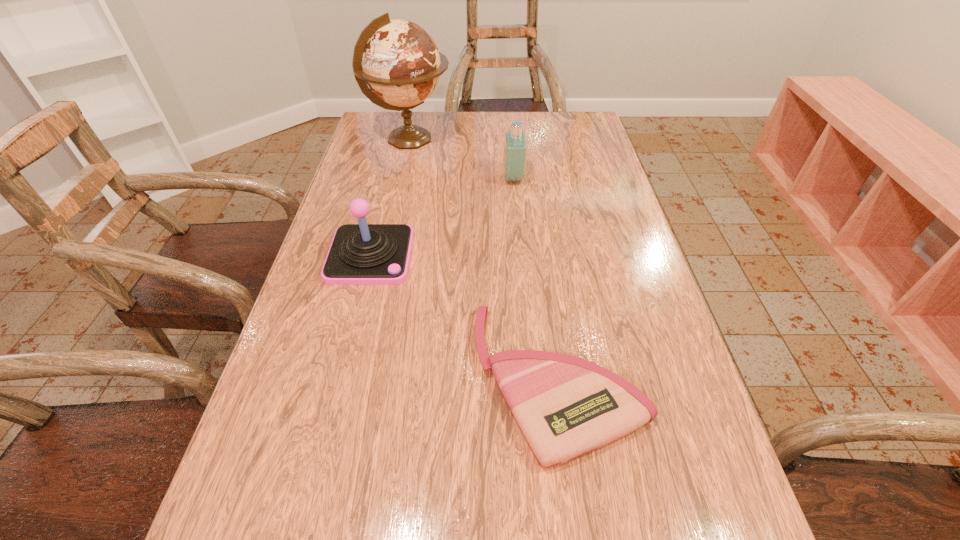
Where is `vacant area at the far right corner`? The width and height of the screenshot is (960, 540). vacant area at the far right corner is located at coordinates (594, 145).

You are a GUI agent. You are given a task and a screenshot of the screen. Output one action in this format:
    pyautogui.click(x=<x>, y=<y>)
    Task: Click on the vacant area that lies between the third nearest object and the joystick
    This screenshot has width=960, height=540.
    Given the screenshot: What is the action you would take?
    pyautogui.click(x=442, y=217)

Where is `vacant region between the perfume and the nearest object`? Image resolution: width=960 pixels, height=540 pixels. vacant region between the perfume and the nearest object is located at coordinates (536, 279).

Where is `free space between the tallest object and the joystick`? free space between the tallest object and the joystick is located at coordinates (391, 198).

What are the coordinates of `free space that is in between the second farthest object and the shortest object` in the screenshot? It's located at (536, 279).

Locate which object ranks third in proximity to the third farthest object. Please provide its 2D coordinates. Your answer should be formatted as a tuple, i.e. [(x, y)], where the tuple contains the x and y coordinates of a point satisfying the conditions above.

[(399, 61)]

Identify which object is the second closest to the perfume. Please provide its 2D coordinates. Your answer should be formatted as a tuple, i.e. [(x, y)], where the tuple contains the x and y coordinates of a point satisfying the conditions above.

[(360, 254)]

Image resolution: width=960 pixels, height=540 pixels. In order to click on free space that satisfies the following two spatial constraints: 1. on the front label of the perfume; 2. on the right side of the nearest object in this screenshot , I will do `click(532, 380)`.

In order to click on vacant space that satisfies the following two spatial constraints: 1. on the front label of the shortest object; 2. on the right side of the perfume in this screenshot , I will do `click(532, 380)`.

I want to click on free location that satisfies the following two spatial constraints: 1. on the front label of the third nearest object; 2. forward from the base of the joystick, so click(x=520, y=255).